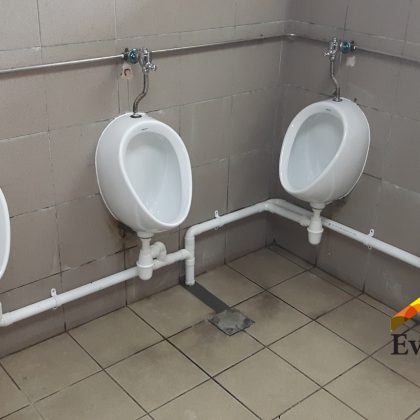
Where is `men's bathroom`? men's bathroom is located at coordinates (69, 36).